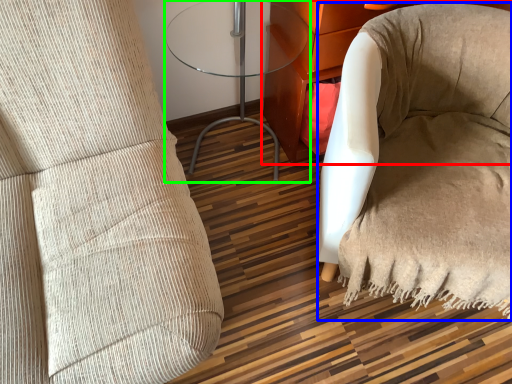
Question: Based on their relative distances, which object is nearer to furniture (highlighted by a red box)? Choose from bean bag chair (highlighted by a blue box) and table (highlighted by a green box).

Choices:
 (A) bean bag chair
 (B) table

Answer: (B)